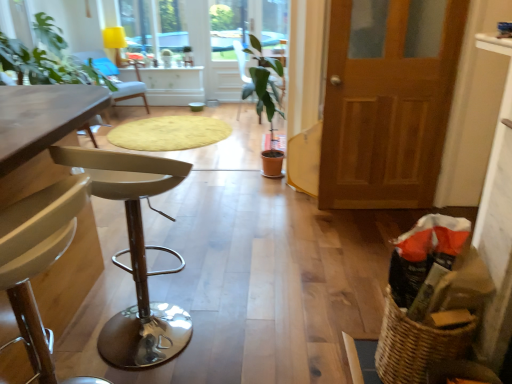
Question: Does woven brown basket at lower right have a larger size compared to wooden table at left, which appears as the second table when viewed from the left?

Choices:
 (A) no
 (B) yes

Answer: (A)

Question: Could you tell me if woven brown basket at lower right is turned towards wooden table at left, marked as the 1th table in a front-to-back arrangement?

Choices:
 (A) yes
 (B) no

Answer: (A)

Question: From a real-world perspective, is woven brown basket at lower right under wooden table at left, marked as the first table in a right-to-left arrangement?

Choices:
 (A) yes
 (B) no

Answer: (A)

Question: Can you confirm if woven brown basket at lower right is smaller than wooden table at left, which appears as the second table when viewed from the left?

Choices:
 (A) no
 (B) yes

Answer: (B)

Question: Is woven brown basket at lower right thinner than wooden table at left, marked as the first table in a right-to-left arrangement?

Choices:
 (A) no
 (B) yes

Answer: (B)

Question: In the image, is green matte plant at center, placed as the 1th chair when sorted from right to left, positioned in front of or behind transparent glass window at upper center?

Choices:
 (A) front
 (B) behind

Answer: (A)

Question: Considering the positions of green matte plant at center, positioned as the third chair in left-to-right order, and transparent glass window at upper center in the image, is green matte plant at center, positioned as the third chair in left-to-right order, bigger or smaller than transparent glass window at upper center?

Choices:
 (A) big
 (B) small

Answer: (B)

Question: In the image, is green matte plant at center, the second chair viewed from the front, on the left side or the right side of transparent glass window at upper center?

Choices:
 (A) right
 (B) left

Answer: (A)

Question: Is green matte plant at center, which is counted as the 2th chair, starting from the back, taller or shorter than transparent glass window at upper center?

Choices:
 (A) short
 (B) tall

Answer: (B)

Question: From a real-world perspective, relative to green matte plant at center, the second chair viewed from the front, is wooden table at left, marked as the first table in a right-to-left arrangement, vertically above or below?

Choices:
 (A) above
 (B) below

Answer: (B)

Question: From their relative heights in the image, would you say wooden table at left, which is the 2th table from back to front, is taller or shorter than green matte plant at center, positioned as the third chair in left-to-right order?

Choices:
 (A) tall
 (B) short

Answer: (B)

Question: In terms of width, does wooden table at left, which appears as the second table when viewed from the left, look wider or thinner when compared to green matte plant at center, which is counted as the 2th chair, starting from the back?

Choices:
 (A) wide
 (B) thin

Answer: (A)

Question: Based on their positions, is wooden table at left, marked as the 1th table in a front-to-back arrangement, located to the left or right of green matte plant at center, positioned as the third chair in left-to-right order?

Choices:
 (A) left
 (B) right

Answer: (A)

Question: Relative to transparent glass window at upper center, is light gray fabric chair at upper left, the first chair when ordered from back to front, in front or behind?

Choices:
 (A) front
 (B) behind

Answer: (A)

Question: In terms of height, does light gray fabric chair at upper left, which is the 1th chair in left-to-right order, look taller or shorter compared to transparent glass window at upper center?

Choices:
 (A) short
 (B) tall

Answer: (A)